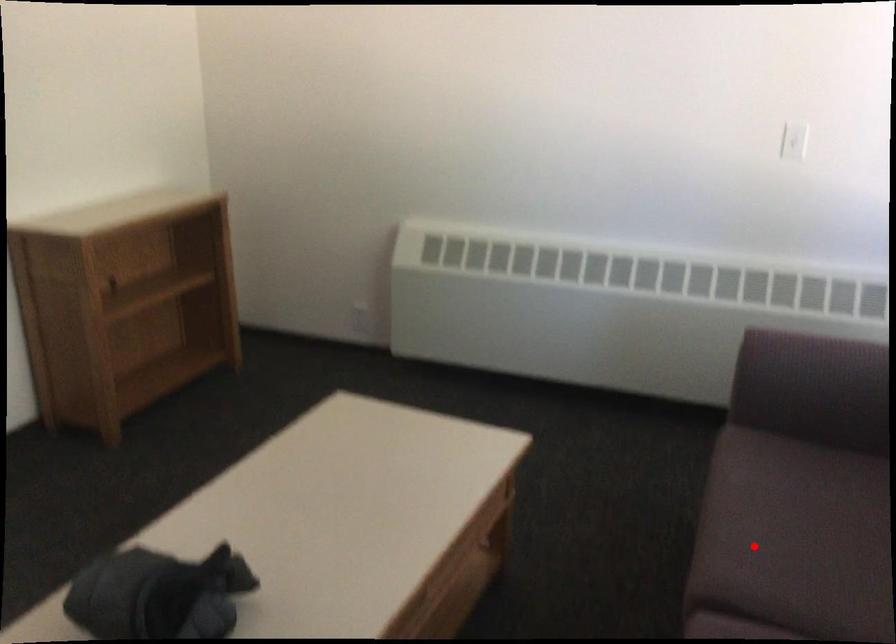
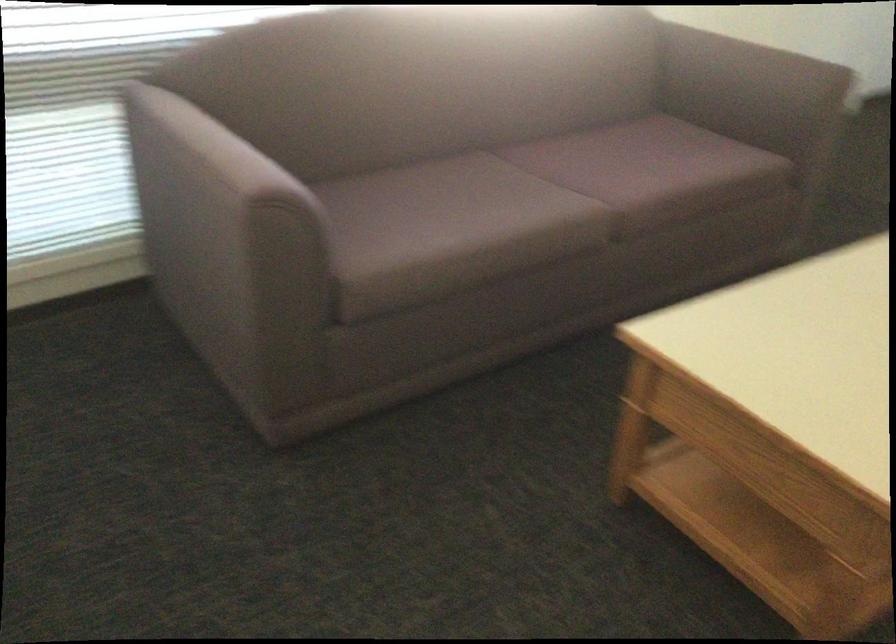
The point at the highlighted location is marked in the first image. Where is the corresponding point in the second image?

(528, 205)